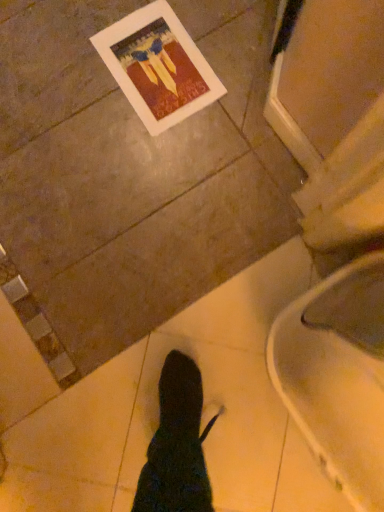
I want to click on free space above matte paper postcard at upper left (from a real-world perspective), so pyautogui.click(x=154, y=61).